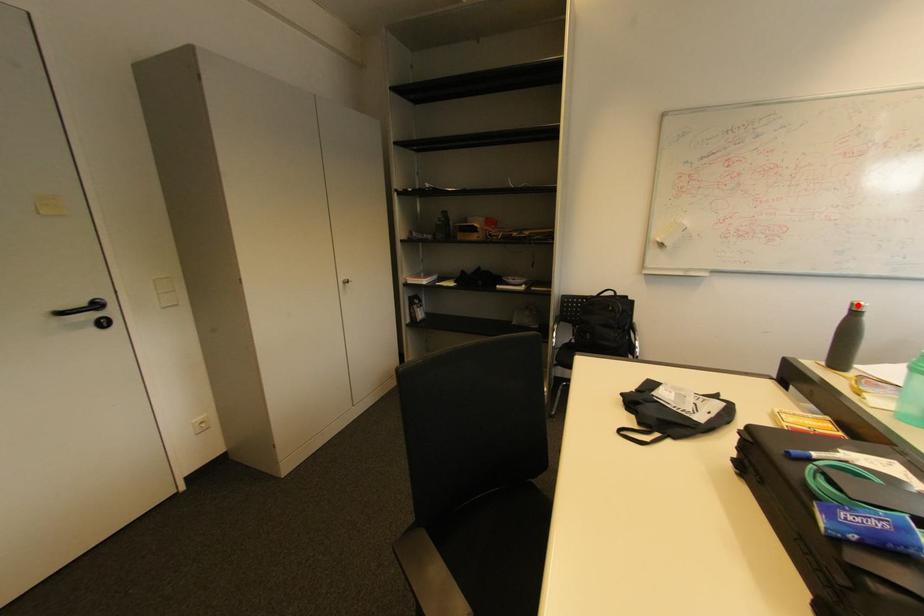
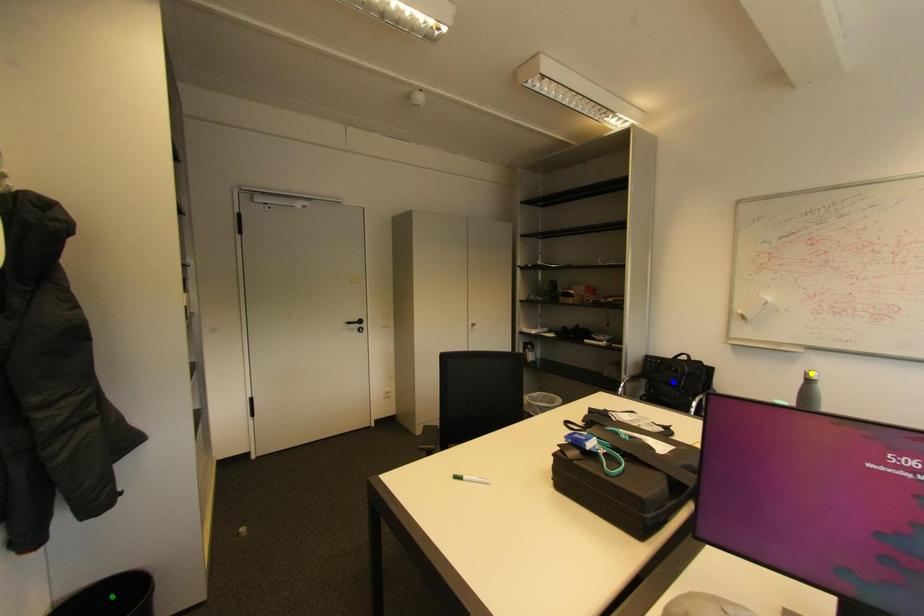
Question: I am providing you with two images of the same scene from different viewpoints. A red point is marked on the first image. You are given multiple points on the second image. Which point in image 2 is actually the same real-world point as the red point in image 1?

Choices:
 (A) green point
 (B) blue point
 (C) yellow point

Answer: (C)